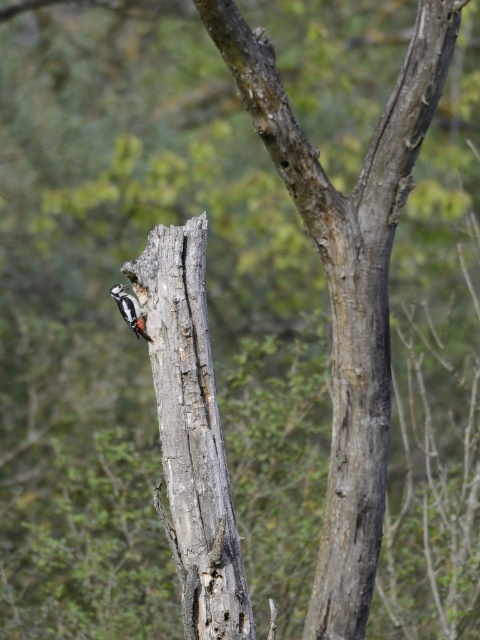
Question: Can you confirm if gray rough bark tree trunk at center is positioned to the right of speckled brown woodpecker at center?

Choices:
 (A) no
 (B) yes

Answer: (B)

Question: Can you confirm if gray rough bark tree trunk at center is positioned above speckled brown woodpecker at center?

Choices:
 (A) no
 (B) yes

Answer: (A)

Question: Is gray rough bark tree trunk at center to the right of speckled brown woodpecker at center from the viewer's perspective?

Choices:
 (A) yes
 (B) no

Answer: (A)

Question: Which object appears closest to the camera in this image?

Choices:
 (A) speckled brown woodpecker at center
 (B) gray rough bark tree trunk at center

Answer: (B)

Question: Which object appears farthest from the camera in this image?

Choices:
 (A) gray rough bark tree trunk at center
 (B) speckled brown woodpecker at center

Answer: (B)